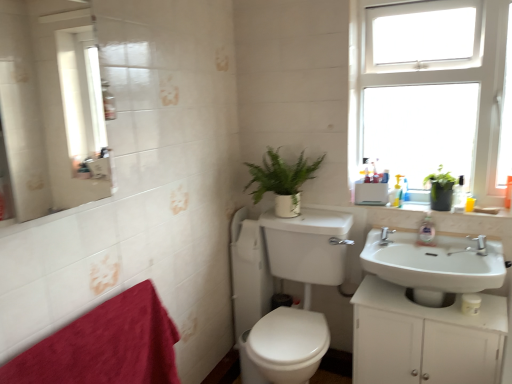
I want to click on vacant space positioned to the left of white matte toilet paper at lower center, so click(440, 307).